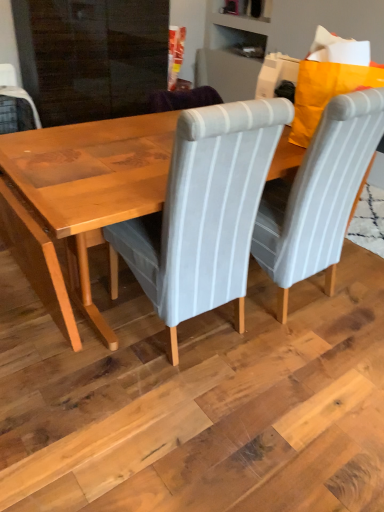
Locate an element on the screen. vacant space to the right of light gray fabric chair at center, the 1th chair positioned from the left is located at coordinates (289, 359).